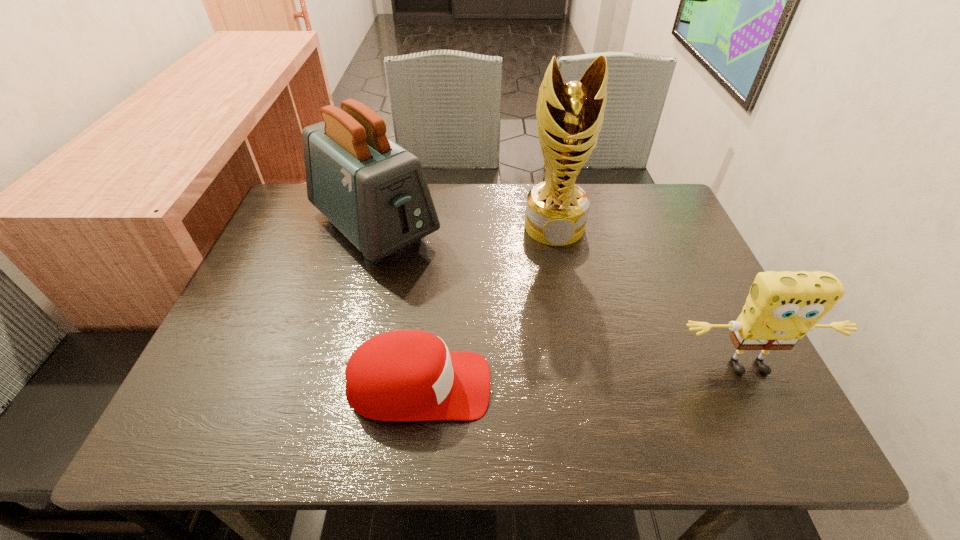
The width and height of the screenshot is (960, 540). Find the location of `object located at the near right corner`. object located at the near right corner is located at coordinates (781, 308).

What are the coordinates of `free space at the far edge` in the screenshot? It's located at (456, 211).

At what (x,y) coordinates should I click in order to perform the action: click on vacant space at the near edge. Please return your answer as a coordinate pair (x, y). Looking at the image, I should click on (500, 394).

The width and height of the screenshot is (960, 540). In the image, there is a desktop. Find the location of `free region at the left edge`. free region at the left edge is located at coordinates (271, 298).

You are a GUI agent. You are given a task and a screenshot of the screen. Output one action in this format:
    pyautogui.click(x=<x>, y=<y>)
    Task: Click on the vacant space at the right edge of the desktop
    This screenshot has width=960, height=540.
    Given the screenshot: What is the action you would take?
    pyautogui.click(x=646, y=252)

The width and height of the screenshot is (960, 540). I want to click on free spot at the far right corner of the desktop, so click(676, 212).

In the image, there is a desktop. Identify the location of vacant space at the near right corner. (726, 389).

Locate an element on the screen. The height and width of the screenshot is (540, 960). vacant region between the tallest object and the third tallest object is located at coordinates coord(652,298).

You are a GUI agent. You are given a task and a screenshot of the screen. Output one action in this format:
    pyautogui.click(x=<x>, y=<y>)
    Task: Click on the vacant area that lies between the toaster and the rightmost object
    
    Given the screenshot: What is the action you would take?
    pyautogui.click(x=562, y=298)

This screenshot has width=960, height=540. What are the coordinates of `vacant space in between the shortest object and the tallest object` in the screenshot? It's located at (487, 306).